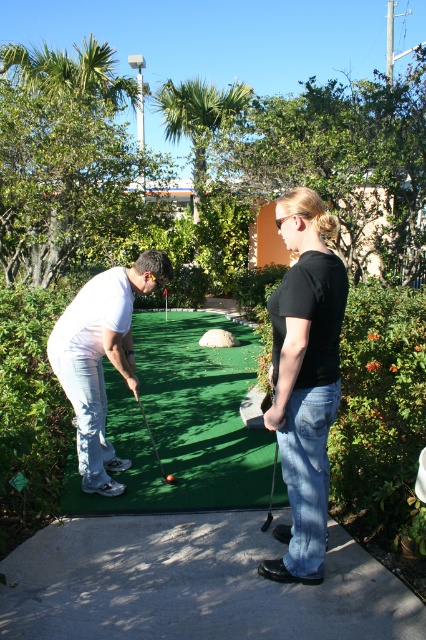
You are a mini golf player trying to hit the glossy plastic golf ball at center into the hole. The green artificial turf at center is in the way. Can you hit the ball directly without the turf affecting the ball?

The green artificial turf at center is taller than the glossy plastic golf ball at center, so the turf might block the direct path or affect the ball when hitting it. You should adjust your shot to avoid the turf.

You are a mini golf player trying to hit the ball into the hole. You have a metallic silver golf club at center and the green artificial turf at center where you stand. Which object is bigger in size?

The green artificial turf at center has a larger size compared to the metallic silver golf club at center, so the green artificial turf at center is bigger in size.

You are standing at point [172,474] and want to walk to point [158,424]. Given that the mini golf course has a narrow path between the two points, will you be able to walk backward without stepping off the path?

Point [158,424] is behind point [172,474], so you can walk backward to reach point [158,424] without stepping off the path.